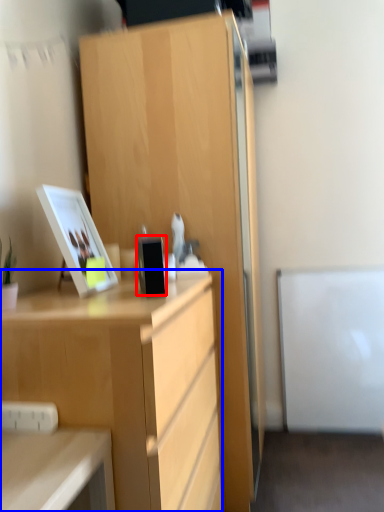
Question: Among these objects, which one is nearest to the camera, appliance (highlighted by a red box) or desk (highlighted by a blue box)?

Choices:
 (A) appliance
 (B) desk

Answer: (B)